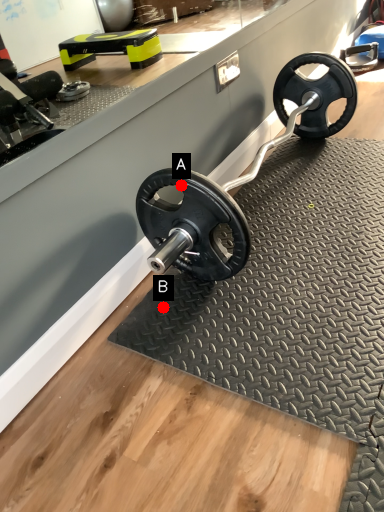
Question: Two points are circled on the image, labeled by A and B beside each circle. Which of the following is the closest to the observer?

Choices:
 (A) A is closer
 (B) B is closer

Answer: (A)